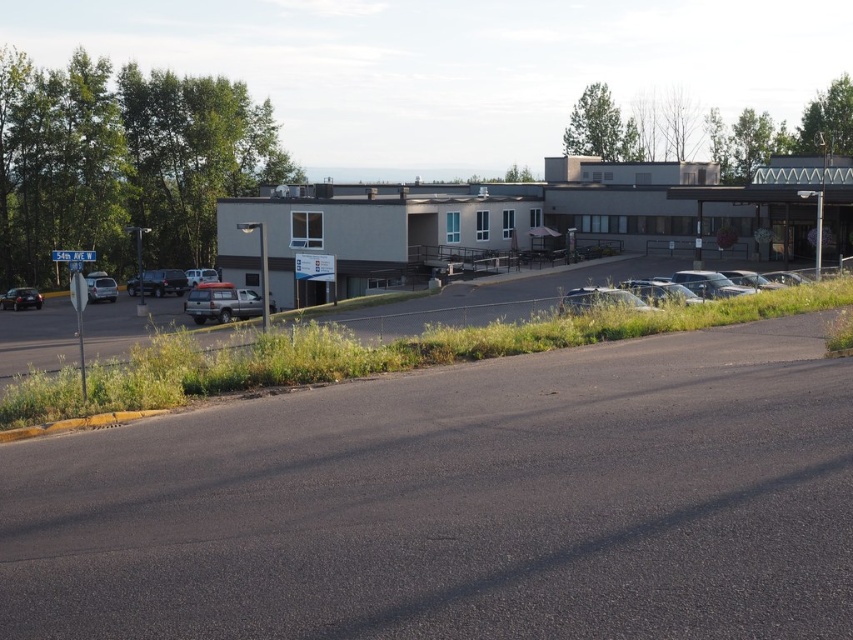
Is asphalt pavement at lower center thinner than silver metallic van at center?

No, asphalt pavement at lower center is not thinner than silver metallic van at center.

Can you confirm if asphalt pavement at lower center is positioned above silver metallic van at center?

No.

Does point (210, 413) come in front of point (206, 268)?

That is True.

At what (x,y) coordinates should I click in order to perform the action: click on asphalt pavement at lower center. Please return your answer as a coordinate pair (x, y). Looking at the image, I should click on (459, 504).

Measure the distance between satin silver suv at center and matte silver sedan at left.

satin silver suv at center and matte silver sedan at left are 11.98 meters apart.

Can you confirm if satin silver suv at center is smaller than matte silver sedan at left?

Indeed, satin silver suv at center has a smaller size compared to matte silver sedan at left.

Identify the location of satin silver suv at center. (221, 301).

How distant is shiny black suv at left from silver metallic van at center?

shiny black suv at left is 9.41 feet from silver metallic van at center.

Locate an element on the screen. This screenshot has width=853, height=640. shiny black suv at left is located at coordinates (158, 282).

This screenshot has width=853, height=640. In order to click on shiny black suv at left in this screenshot , I will do `click(158, 282)`.